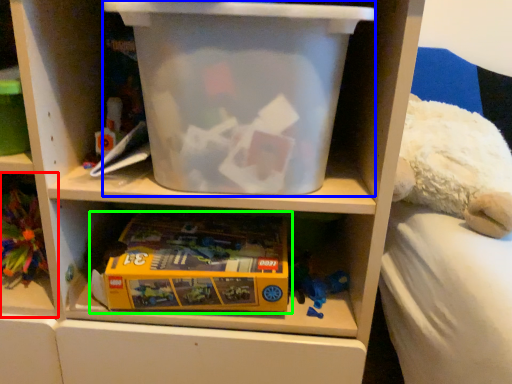
Question: Based on their relative distances, which object is farther from shelf (highlighted by a red box)? Choose from storage box (highlighted by a blue box) and toy (highlighted by a green box).

Choices:
 (A) storage box
 (B) toy

Answer: (A)